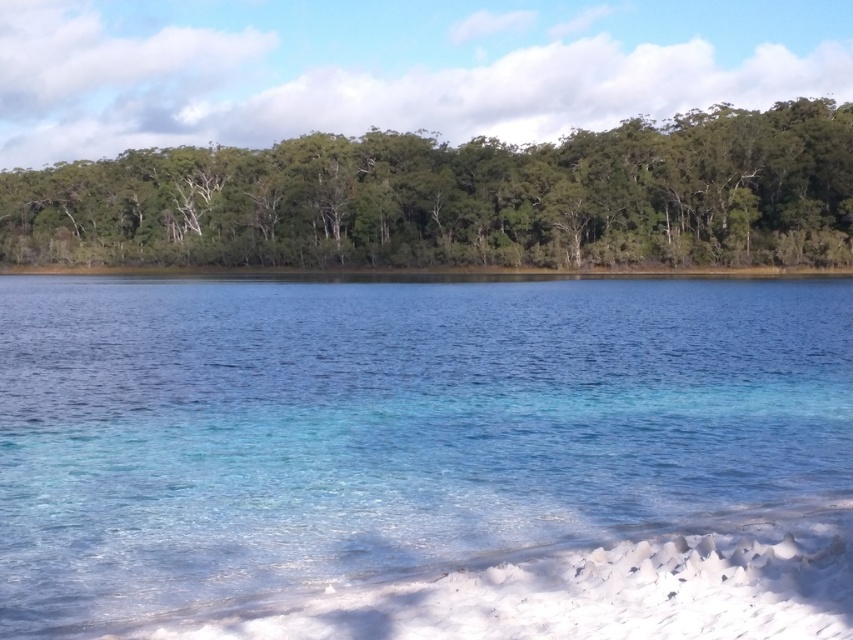
Between clear glass water at center and green leafy trees at upper center, which one is positioned lower?

clear glass water at center

Does point (503, 392) lie in front of point (258, 154)?

Yes, it is.

At what (x,y) coordinates should I click in order to perform the action: click on clear glass water at center. Please return your answer as a coordinate pair (x, y). Image resolution: width=853 pixels, height=640 pixels. Looking at the image, I should click on (424, 458).